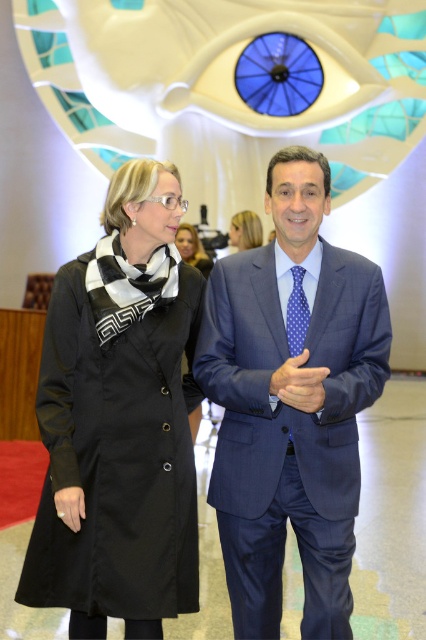
Consider the image. Is blue dotted tie at center behind black matte coat at center?

No, it is in front of black matte coat at center.

Does point (291, 273) lie in front of point (181, 230)?

Yes, point (291, 273) is closer to viewer.

You are a GUI agent. You are given a task and a screenshot of the screen. Output one action in this format:
    pyautogui.click(x=<x>, y=<y>)
    Task: Click on the blue dotted tie at center
    Image resolution: width=426 pixels, height=640 pixels.
    Given the screenshot: What is the action you would take?
    pyautogui.click(x=296, y=314)

Who is more forward, (273, 220) or (71, 496)?

Point (71, 496) is in front.

Consider the image. Which of these two, blue polished suit at center or black matte hand at lower left, stands taller?

blue polished suit at center

The image size is (426, 640). What do you see at coordinates (290, 406) in the screenshot? I see `blue polished suit at center` at bounding box center [290, 406].

I want to click on blue polished suit at center, so [290, 406].

Is point (173, 220) positioned behind point (181, 371)?

No, it is in front of (181, 371).

Between black wool coat at left and black matte coat at center, which one has more height?

Standing taller between the two is black wool coat at left.

Which is behind, point (51, 422) or point (199, 269)?

The point (199, 269) is behind.

Locate an element on the screen. The width and height of the screenshot is (426, 640). black wool coat at left is located at coordinates (120, 419).